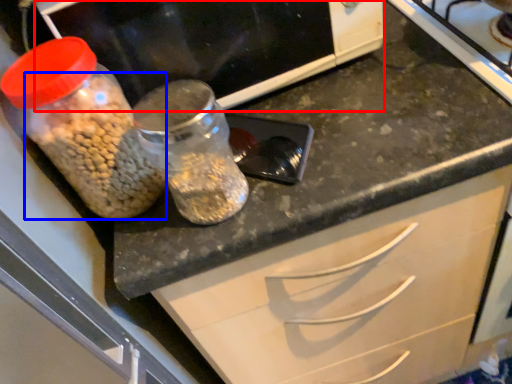
Question: Which object appears farthest to the camera in this image, wide (highlighted by a red box) or food (highlighted by a blue box)?

Choices:
 (A) wide
 (B) food

Answer: (A)